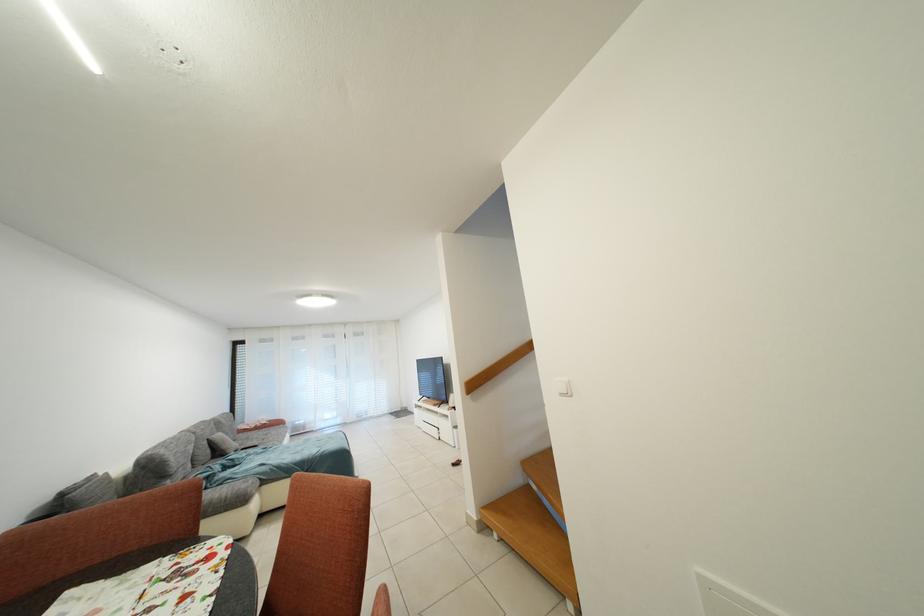
Identify the location of white light switch. The height and width of the screenshot is (616, 924). (563, 387).